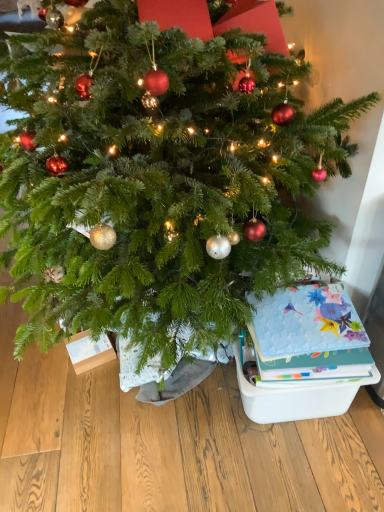
I want to click on free space in front of matte plastic storage box at lower right, so click(x=298, y=465).